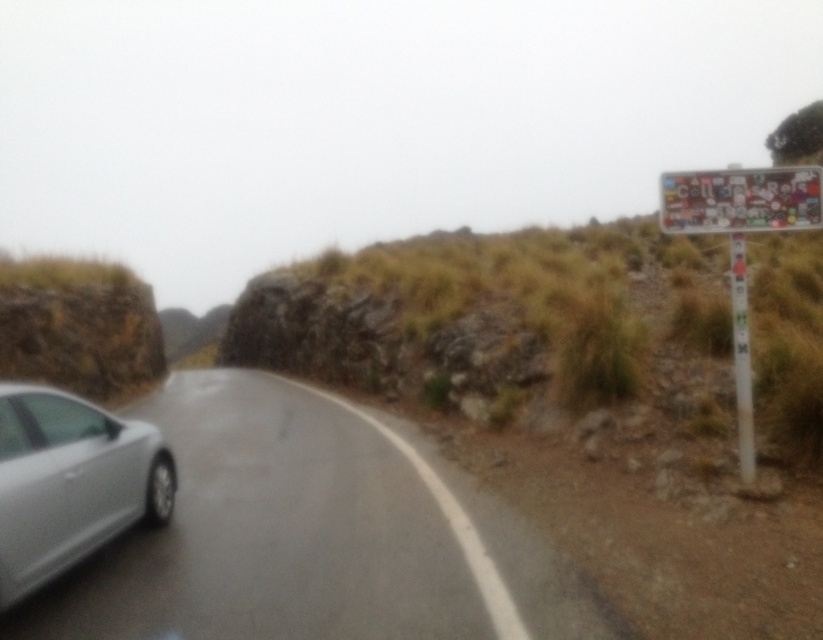
Is satin silver car at left taller than multicolored stickers at upper right?

Correct, satin silver car at left is much taller as multicolored stickers at upper right.

Is satin silver car at left bigger than multicolored stickers at upper right?

Correct, satin silver car at left is larger in size than multicolored stickers at upper right.

This screenshot has width=823, height=640. What do you see at coordinates (70, 483) in the screenshot?
I see `satin silver car at left` at bounding box center [70, 483].

Locate an element on the screen. The height and width of the screenshot is (640, 823). satin silver car at left is located at coordinates point(70,483).

Can you confirm if satin silver car at left is bigger than multicolored stickers at right?

Actually, satin silver car at left might be smaller than multicolored stickers at right.

Who is positioned more to the right, satin silver car at left or multicolored stickers at right?

multicolored stickers at right is more to the right.

At what (x,y) coordinates should I click in order to perform the action: click on satin silver car at left. Please return your answer as a coordinate pair (x, y). The height and width of the screenshot is (640, 823). Looking at the image, I should click on (70, 483).

Where is `satin silver car at left`? This screenshot has width=823, height=640. satin silver car at left is located at coordinates (70, 483).

Who is positioned more to the left, silver metallic car at left or multicolored stickers at upper right?

From the viewer's perspective, silver metallic car at left appears more on the left side.

Locate an element on the screen. This screenshot has height=640, width=823. silver metallic car at left is located at coordinates (312, 536).